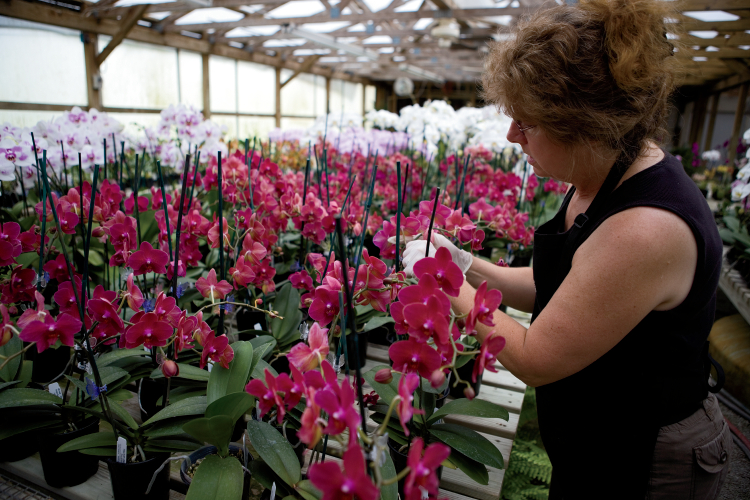
You are a GUI agent. You are given a task and a screenshot of the screen. Output one action in this format:
    pyautogui.click(x=<x>, y=<y>)
    Task: Click on the orchids
    The width and height of the screenshot is (750, 500).
    Given the screenshot: What is the action you would take?
    pos(145,322), pos(274,215), pos(426,317), pos(321,408), pos(106,232)